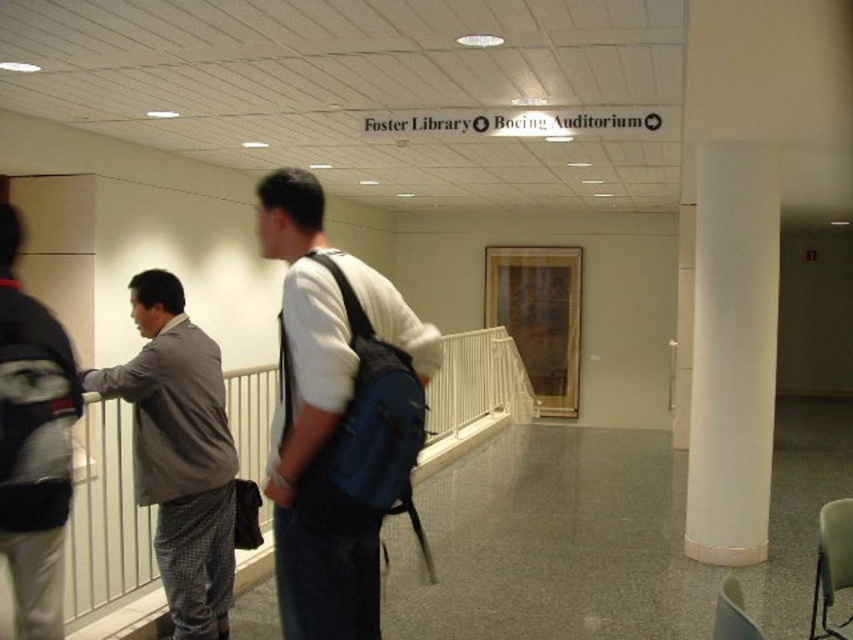
You are a visitor in this hallway and want to know if the gray fabric jacket at left is hanging on the white plastic rail at center. Based on the scene description, can you determine if this is possible?

The white plastic rail at center is below the gray fabric jacket at left, so the jacket could be hanging on the rail since the rail is positioned under the jacket.

You are a maintenance worker needing to place a 1.5 meter long tool on either the white plastic rail at center or the gray fabric jacket at left. Which object can the tool fit on without overhanging?

The gray fabric jacket at left is taller than the white plastic rail at center, so the tool can fit on the gray fabric jacket at left without overhanging.